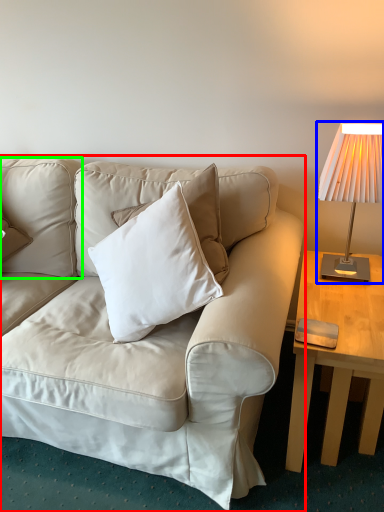
Question: Considering the real-world distances, which object is closest to studio couch (highlighted by a red box)? lamp (highlighted by a blue box) or pillow (highlighted by a green box).

Choices:
 (A) lamp
 (B) pillow

Answer: (B)